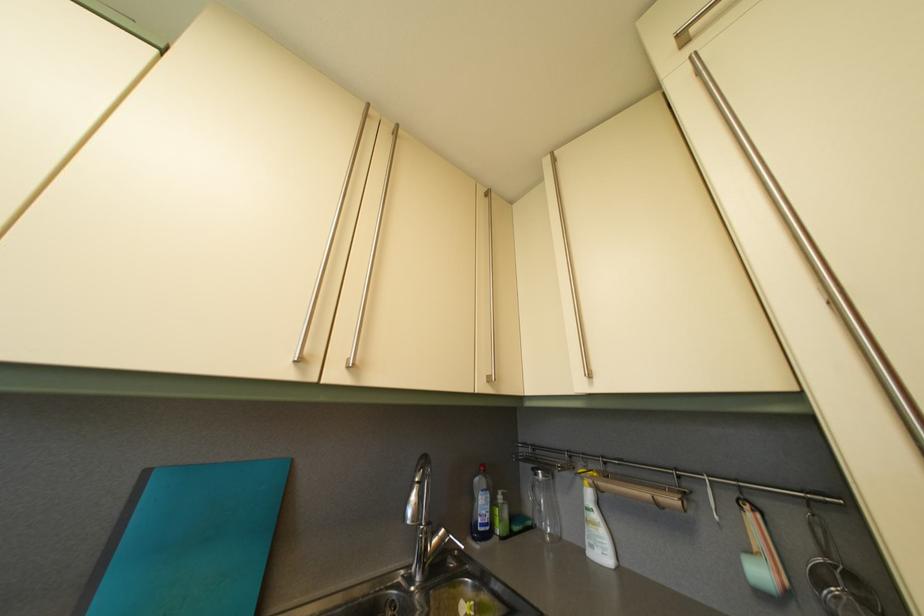
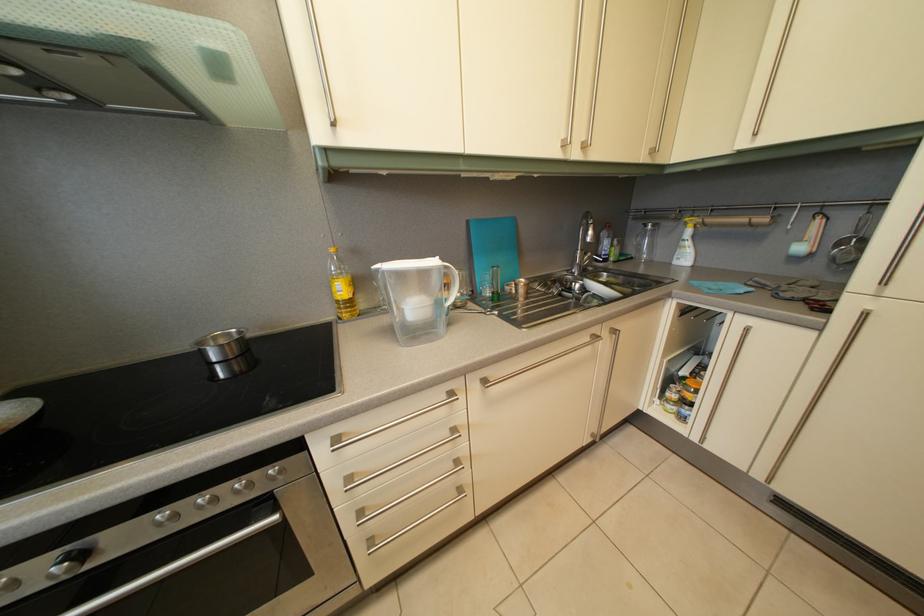
Locate, in the second image, the point that corresponds to point (758, 559) in the first image.

(808, 248)